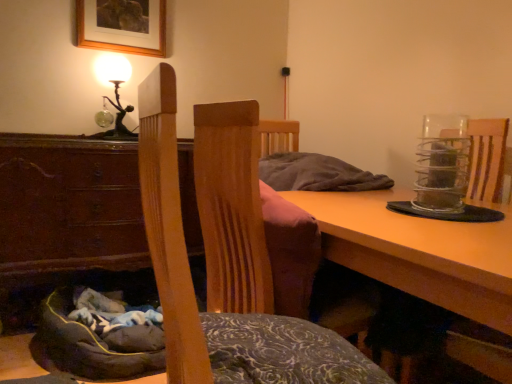
Question: Does dark gray fabric bean bag at lower left come behind brown wood cabinet at lower left?

Choices:
 (A) yes
 (B) no

Answer: (B)

Question: Does dark gray fabric bean bag at lower left appear on the right side of brown wood cabinet at lower left?

Choices:
 (A) no
 (B) yes

Answer: (B)

Question: From a real-world perspective, does dark gray fabric bean bag at lower left stand above brown wood cabinet at lower left?

Choices:
 (A) yes
 (B) no

Answer: (B)

Question: Can you confirm if dark gray fabric bean bag at lower left is bigger than brown wood cabinet at lower left?

Choices:
 (A) yes
 (B) no

Answer: (B)

Question: Is dark gray fabric bean bag at lower left facing towards brown wood cabinet at lower left?

Choices:
 (A) no
 (B) yes

Answer: (A)

Question: Considering their positions, is brown wood cabinet at lower left located in front of or behind wooden table at lower center?

Choices:
 (A) behind
 (B) front

Answer: (A)

Question: From a real-world perspective, is brown wood cabinet at lower left physically located above or below wooden table at lower center?

Choices:
 (A) above
 (B) below

Answer: (A)

Question: Is point (79, 165) closer or farther from the camera than point (426, 279)?

Choices:
 (A) closer
 (B) farther

Answer: (B)

Question: Considering the positions of brown wood cabinet at lower left and wooden table at lower center in the image, is brown wood cabinet at lower left bigger or smaller than wooden table at lower center?

Choices:
 (A) small
 (B) big

Answer: (A)

Question: Considering the positions of wooden picture frame at upper center and wooden table at lower center in the image, is wooden picture frame at upper center bigger or smaller than wooden table at lower center?

Choices:
 (A) small
 (B) big

Answer: (A)

Question: Visually, is wooden picture frame at upper center positioned to the left or to the right of wooden table at lower center?

Choices:
 (A) left
 (B) right

Answer: (A)

Question: Relative to wooden table at lower center, is wooden picture frame at upper center in front or behind?

Choices:
 (A) behind
 (B) front

Answer: (A)

Question: Would you say wooden picture frame at upper center is inside or outside wooden table at lower center?

Choices:
 (A) inside
 (B) outside

Answer: (B)

Question: Considering the positions of point (194, 157) and point (117, 99), is point (194, 157) closer or farther from the camera than point (117, 99)?

Choices:
 (A) farther
 (B) closer

Answer: (B)

Question: Is wooden chair at center wider or thinner than metallic glass table lamp at upper left?

Choices:
 (A) wide
 (B) thin

Answer: (A)